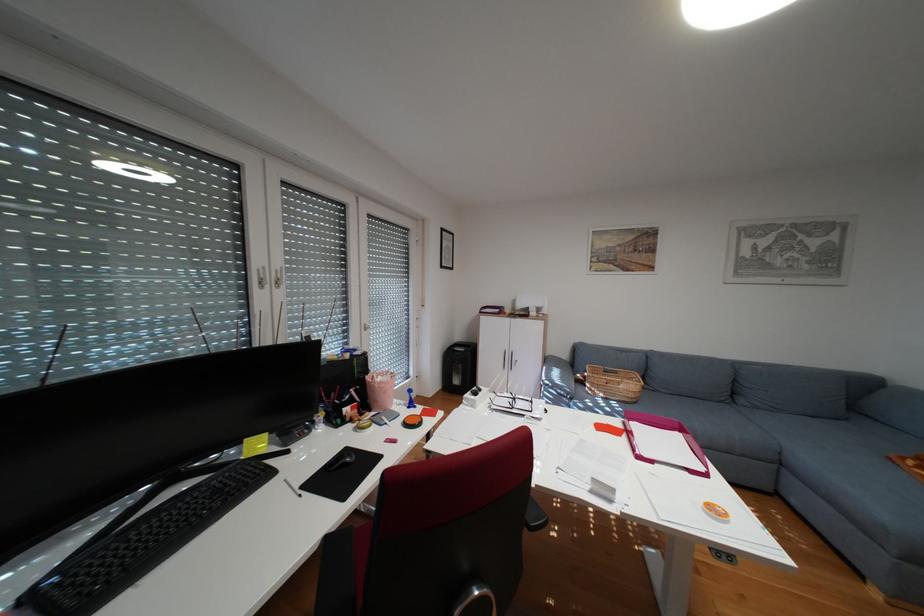
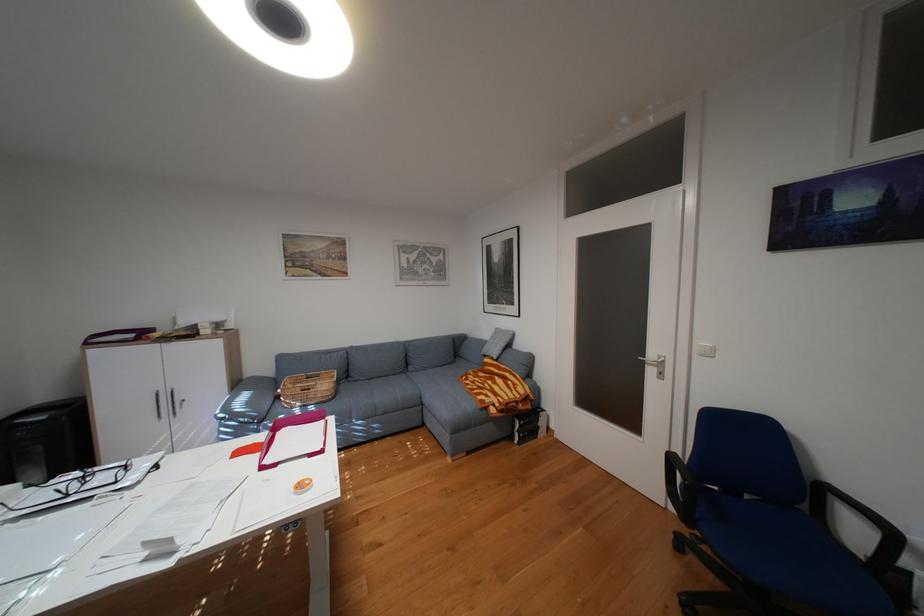
Where in the second image is the point corresponding to (521,360) from the first image?

(180, 403)